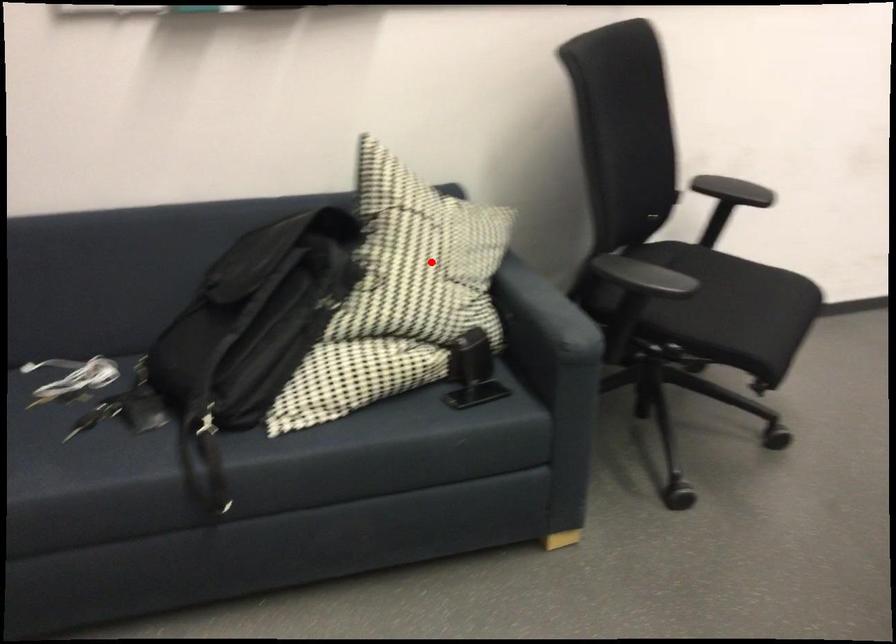
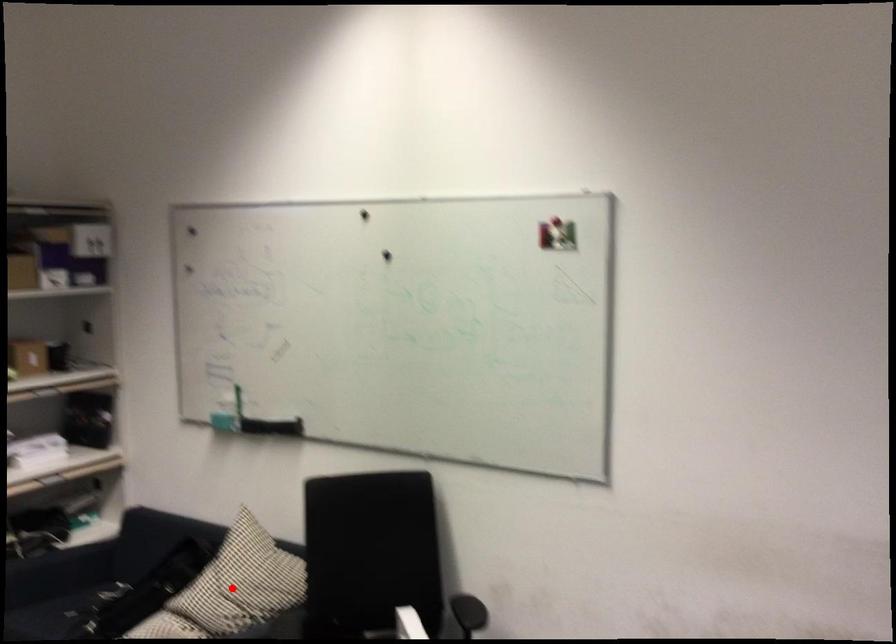
Based on the photo, I am providing you with two images of the same scene from different viewpoints. A red point is marked on the first image and another point is marked on the second image. Are the points marked in image1 and image2 representing the same 3D position?

Yes